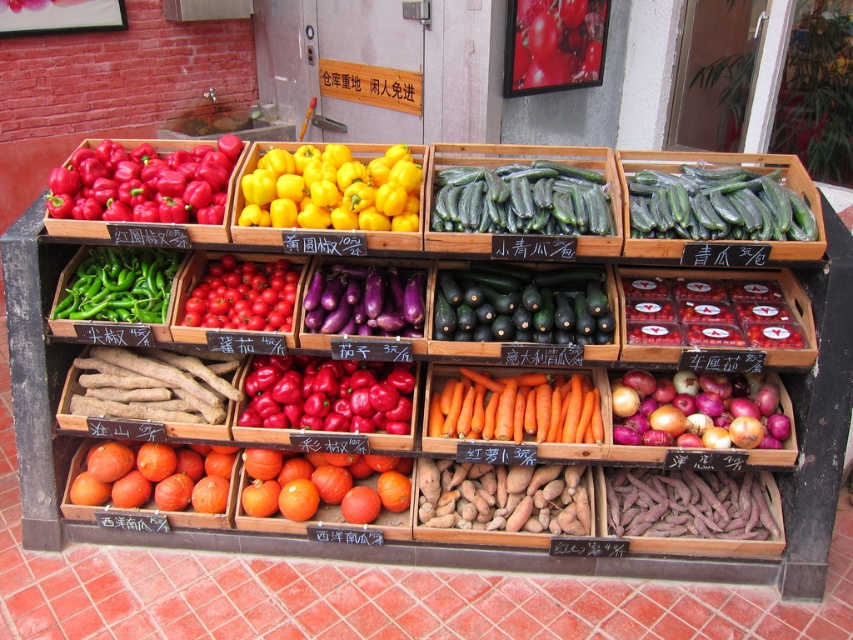
Who is shorter, red matte onions at bottom right or red glossy tomatoes at upper center?

red matte onions at bottom right

Is red matte onions at bottom right closer to the viewer compared to red glossy tomatoes at upper center?

Yes.

Is point (732, 408) more distant than point (524, 60)?

That is False.

Where is `red matte onions at bottom right`? The height and width of the screenshot is (640, 853). red matte onions at bottom right is located at coordinates (697, 412).

Can you confirm if orange smooth carrot at center is shorter than purple matte sweet potato at lower right?

No, orange smooth carrot at center is not shorter than purple matte sweet potato at lower right.

Which of these two, orange smooth carrot at center or purple matte sweet potato at lower right, stands shorter?

With less height is purple matte sweet potato at lower right.

At what (x,y) coordinates should I click in order to perform the action: click on orange smooth carrot at center. Please return your answer as a coordinate pair (x, y). The height and width of the screenshot is (640, 853). Looking at the image, I should click on (517, 406).

Is point (508, 326) in front of point (259, 401)?

Yes, it is.

Can you confirm if green matte zucchini at center is positioned to the right of matte red pepper at center?

Correct, you'll find green matte zucchini at center to the right of matte red pepper at center.

Locate an element on the screen. Image resolution: width=853 pixels, height=640 pixels. green matte zucchini at center is located at coordinates (521, 305).

Where is `green matte zucchini at center`? The height and width of the screenshot is (640, 853). green matte zucchini at center is located at coordinates (521, 305).